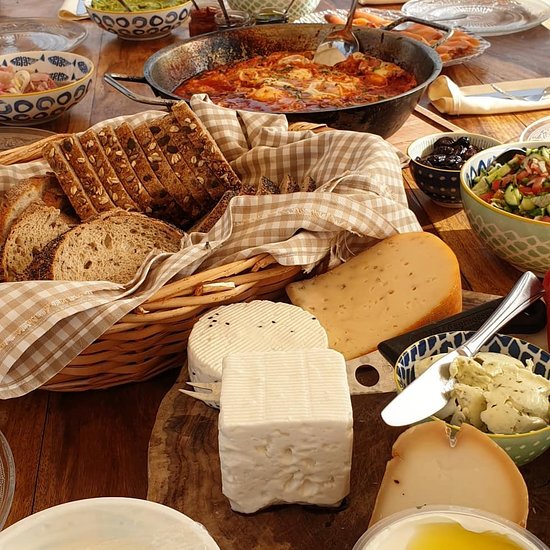
Where is `spoon`? This screenshot has width=550, height=550. spoon is located at coordinates (329, 43).